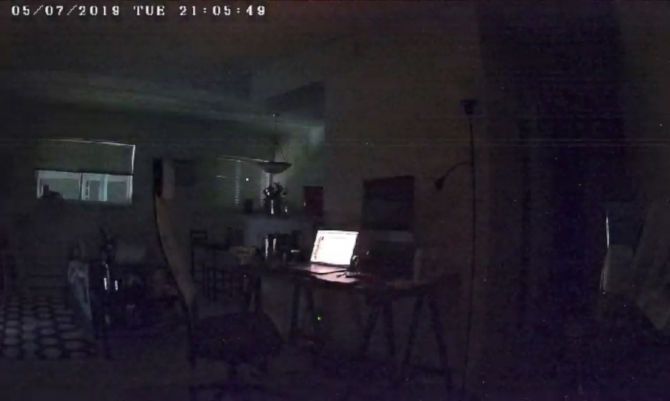
Locate an element on the screen. The height and width of the screenshot is (401, 670). laptop screen is located at coordinates pyautogui.click(x=348, y=236).